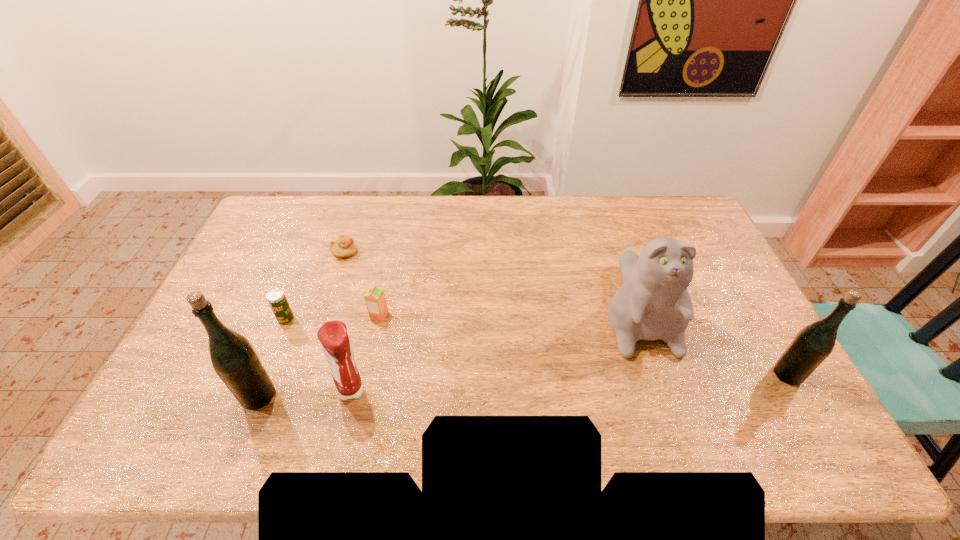
Where is `vacant area that lies between the fifth object from right to left and the orange juice`? vacant area that lies between the fifth object from right to left and the orange juice is located at coordinates (362, 284).

Identify the location of vacant point located between the taller beer bottle and the fourth tallest object. (305, 393).

At what (x,y) coordinates should I click in order to perform the action: click on vacant space in between the second object from right to left and the fourth shortest object. Please return your answer as a coordinate pair (x, y). This screenshot has height=540, width=960. Looking at the image, I should click on (494, 348).

Find the location of a particular element. The width and height of the screenshot is (960, 540). free area in between the orange juice and the beer can is located at coordinates (333, 318).

The height and width of the screenshot is (540, 960). I want to click on object that stands as the sixth closest to the condiment, so click(814, 343).

Identify the location of object that ranks as the third closest to the third object from left to right. This screenshot has width=960, height=540. (333, 336).

The image size is (960, 540). Find the location of `vacant space that satisfies the following two spatial constraints: 1. on the front-facing side of the duckling; 2. on the front side of the taller beer bottle`. vacant space that satisfies the following two spatial constraints: 1. on the front-facing side of the duckling; 2. on the front side of the taller beer bottle is located at coordinates (298, 396).

Identify the location of free space that satisfies the following two spatial constraints: 1. on the front-facing side of the shortest object; 2. on the right side of the orange juice. This screenshot has height=540, width=960. (324, 315).

The height and width of the screenshot is (540, 960). What are the coordinates of `vacant point that satisfies the following two spatial constraints: 1. on the back side of the orange juice; 2. on the right side of the condiment` in the screenshot? It's located at (370, 315).

What are the coordinates of `vacant point that satisfies the following two spatial constraints: 1. on the back side of the orange juice; 2. on the front-facing side of the shortest object` in the screenshot? It's located at (393, 252).